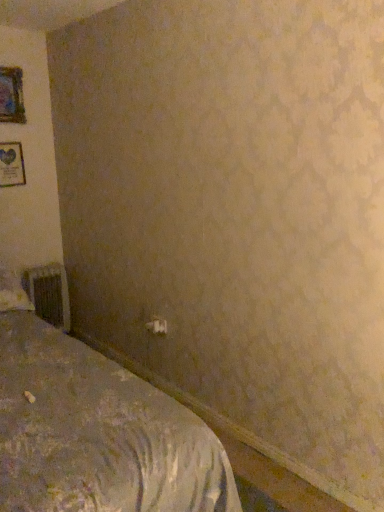
In order to click on metallic silver radiator at lower left in this screenshot , I will do `click(49, 294)`.

Identify the location of wooden picture frame at upper left, the second picture frame from the bottom. (11, 95).

Image resolution: width=384 pixels, height=512 pixels. What do you see at coordinates (13, 293) in the screenshot? I see `white fabric pillow at left` at bounding box center [13, 293].

Identify the location of textured gray bed at lower left. The height and width of the screenshot is (512, 384). (97, 433).

Would you say metallic silver radiator at lower left is part of white fabric pillow at left's contents?

Definitely not — metallic silver radiator at lower left is not inside white fabric pillow at left.

Considering the sizes of white fabric pillow at left and metallic silver radiator at lower left in the image, is white fabric pillow at left bigger or smaller than metallic silver radiator at lower left?

Clearly, white fabric pillow at left is larger in size than metallic silver radiator at lower left.

From a real-world perspective, between white fabric pillow at left and metallic silver radiator at lower left, who is vertically lower?

From a 3D spatial view, metallic silver radiator at lower left is below.

Considering the positions of objects white fabric pillow at left and metallic silver radiator at lower left in the image provided, who is more to the left, white fabric pillow at left or metallic silver radiator at lower left?

white fabric pillow at left.

Based on the photo, could you tell me if wooden framed poster at upper left, which ranks as the 2th picture frame in top-to-bottom order, is facing metallic silver radiator at lower left?

No, wooden framed poster at upper left, which ranks as the 2th picture frame in top-to-bottom order, is not facing towards metallic silver radiator at lower left.

Measure the distance from wooden framed poster at upper left, positioned as the 1th picture frame in bottom-to-top order, to metallic silver radiator at lower left.

33.03 inches.

Which point is more distant from viewer, (x=5, y=183) or (x=29, y=286)?

Point (x=29, y=286)

Can you see wooden framed poster at upper left, which ranks as the 2th picture frame in top-to-bottom order, touching metallic silver radiator at lower left?

No, wooden framed poster at upper left, which ranks as the 2th picture frame in top-to-bottom order, is not in contact with metallic silver radiator at lower left.

Is wooden framed poster at upper left, which ranks as the 2th picture frame in top-to-bottom order, outside of wooden picture frame at upper left, the second picture frame from the bottom?

Yes, wooden framed poster at upper left, which ranks as the 2th picture frame in top-to-bottom order, is outside of wooden picture frame at upper left, the second picture frame from the bottom.

Would you consider wooden framed poster at upper left, positioned as the 1th picture frame in bottom-to-top order, to be distant from wooden picture frame at upper left, the second picture frame from the bottom?

They are positioned close to each other.

Based on their sizes in the image, would you say wooden framed poster at upper left, which ranks as the 2th picture frame in top-to-bottom order, is bigger or smaller than wooden picture frame at upper left, the second picture frame from the bottom?

In the image, wooden framed poster at upper left, which ranks as the 2th picture frame in top-to-bottom order, appears to be smaller than wooden picture frame at upper left, the second picture frame from the bottom.

Which is behind, point (13, 183) or point (2, 110)?

The point (13, 183) is more distant.

Is the depth of white plastic electric outlet at lower center greater than that of textured gray bed at lower left?

Yes.

Between white plastic electric outlet at lower center and textured gray bed at lower left, which one has smaller width?

Thinner between the two is white plastic electric outlet at lower center.

Considering the relative sizes of white plastic electric outlet at lower center and textured gray bed at lower left in the image provided, is white plastic electric outlet at lower center shorter than textured gray bed at lower left?

Correct, white plastic electric outlet at lower center is not as tall as textured gray bed at lower left.

Is white plastic electric outlet at lower center at the left side of textured gray bed at lower left?

No, white plastic electric outlet at lower center is not to the left of textured gray bed at lower left.

Is point (13, 300) positioned behind point (153, 326)?

No, it is not.

Is white fabric pillow at left facing away from white plastic electric outlet at lower center?

No, white fabric pillow at left is not facing the opposite direction of white plastic electric outlet at lower center.

Is white fabric pillow at left placed right next to white plastic electric outlet at lower center?

They are not placed beside each other.

From the picture: Choose the correct answer: Is wooden picture frame at upper left, arranged as the 1th picture frame when viewed from the top, inside textured gray bed at lower left or outside it?

The correct answer is: outside.

Is wooden picture frame at upper left, arranged as the 1th picture frame when viewed from the top, positioned with its back to textured gray bed at lower left?

No, wooden picture frame at upper left, arranged as the 1th picture frame when viewed from the top, is not facing the opposite direction of textured gray bed at lower left.

Consider the image. From a real-world perspective, which object stands above the other?

In real-world perspective, wooden picture frame at upper left, the second picture frame from the bottom, is above.

Could you measure the distance between wooden picture frame at upper left, arranged as the 1th picture frame when viewed from the top, and textured gray bed at lower left?

The distance of wooden picture frame at upper left, arranged as the 1th picture frame when viewed from the top, from textured gray bed at lower left is 6.79 feet.

What's the angular difference between white fabric pillow at left and wooden framed poster at upper left, which ranks as the 2th picture frame in top-to-bottom order,'s facing directions?

There is a 2.29-degree angle between the facing directions of white fabric pillow at left and wooden framed poster at upper left, which ranks as the 2th picture frame in top-to-bottom order.

Could wooden framed poster at upper left, positioned as the 1th picture frame in bottom-to-top order, be considered to be inside white fabric pillow at left?

Definitely not — wooden framed poster at upper left, positioned as the 1th picture frame in bottom-to-top order, is not inside white fabric pillow at left.

Considering the relative sizes of white fabric pillow at left and wooden framed poster at upper left, which ranks as the 2th picture frame in top-to-bottom order, in the image provided, is white fabric pillow at left wider than wooden framed poster at upper left, which ranks as the 2th picture frame in top-to-bottom order,?

Yes, white fabric pillow at left is wider than wooden framed poster at upper left, which ranks as the 2th picture frame in top-to-bottom order.

In the scene shown: Considering the positions of objects white fabric pillow at left and wooden framed poster at upper left, which ranks as the 2th picture frame in top-to-bottom order, in the image provided, who is more to the right, white fabric pillow at left or wooden framed poster at upper left, which ranks as the 2th picture frame in top-to-bottom order,?

From the viewer's perspective, white fabric pillow at left appears more on the right side.

Where is `pillow in front of the metallic silver radiator at lower left`? pillow in front of the metallic silver radiator at lower left is located at coordinates (13, 293).

The width and height of the screenshot is (384, 512). What are the coordinates of `radiator below the wooden framed poster at upper left, which ranks as the 2th picture frame in top-to-bottom order (from the image's perspective)` in the screenshot? It's located at (49, 294).

Based on their spatial positions, is white fabric pillow at left or wooden framed poster at upper left, which ranks as the 2th picture frame in top-to-bottom order, closer to wooden picture frame at upper left, arranged as the 1th picture frame when viewed from the top?

Among the two, wooden framed poster at upper left, which ranks as the 2th picture frame in top-to-bottom order, is located nearer to wooden picture frame at upper left, arranged as the 1th picture frame when viewed from the top.

Based on their spatial positions, is wooden picture frame at upper left, the second picture frame from the bottom, or white plastic electric outlet at lower center further from textured gray bed at lower left?

wooden picture frame at upper left, the second picture frame from the bottom, is further to textured gray bed at lower left.

In the scene shown: From the image, which object appears to be nearer to textured gray bed at lower left, wooden framed poster at upper left, which ranks as the 2th picture frame in top-to-bottom order, or metallic silver radiator at lower left?

Among the two, metallic silver radiator at lower left is located nearer to textured gray bed at lower left.

Which object lies nearer to the anchor point textured gray bed at lower left, wooden picture frame at upper left, the second picture frame from the bottom, or white fabric pillow at left?

The object closer to textured gray bed at lower left is white fabric pillow at left.

Estimate the real-world distances between objects in this image. Which object is further from metallic silver radiator at lower left, textured gray bed at lower left or wooden picture frame at upper left, the second picture frame from the bottom?

textured gray bed at lower left is further to metallic silver radiator at lower left.

When comparing their distances from metallic silver radiator at lower left, does white fabric pillow at left or wooden framed poster at upper left, positioned as the 1th picture frame in bottom-to-top order, seem closer?

white fabric pillow at left is positioned closer to the anchor metallic silver radiator at lower left.

Based on their spatial positions, is wooden framed poster at upper left, positioned as the 1th picture frame in bottom-to-top order, or white plastic electric outlet at lower center closer to wooden picture frame at upper left, arranged as the 1th picture frame when viewed from the top?

Based on the image, wooden framed poster at upper left, positioned as the 1th picture frame in bottom-to-top order, appears to be nearer to wooden picture frame at upper left, arranged as the 1th picture frame when viewed from the top.

From the image, which object appears to be nearer to white plastic electric outlet at lower center, wooden framed poster at upper left, positioned as the 1th picture frame in bottom-to-top order, or white fabric pillow at left?

Based on the image, white fabric pillow at left appears to be nearer to white plastic electric outlet at lower center.

This screenshot has height=512, width=384. Find the location of `pillow between wooden picture frame at upper left, arranged as the 1th picture frame when viewed from the top, and metallic silver radiator at lower left from top to bottom`. pillow between wooden picture frame at upper left, arranged as the 1th picture frame when viewed from the top, and metallic silver radiator at lower left from top to bottom is located at coordinates (13, 293).

What are the coordinates of `picture frame between textured gray bed at lower left and wooden framed poster at upper left, which ranks as the 2th picture frame in top-to-bottom order, from front to back` in the screenshot? It's located at (11, 95).

The image size is (384, 512). Identify the location of pillow that lies between wooden framed poster at upper left, positioned as the 1th picture frame in bottom-to-top order, and metallic silver radiator at lower left from top to bottom. (13, 293).

I want to click on pillow between wooden framed poster at upper left, which ranks as the 2th picture frame in top-to-bottom order, and white plastic electric outlet at lower center from left to right, so coord(13,293).